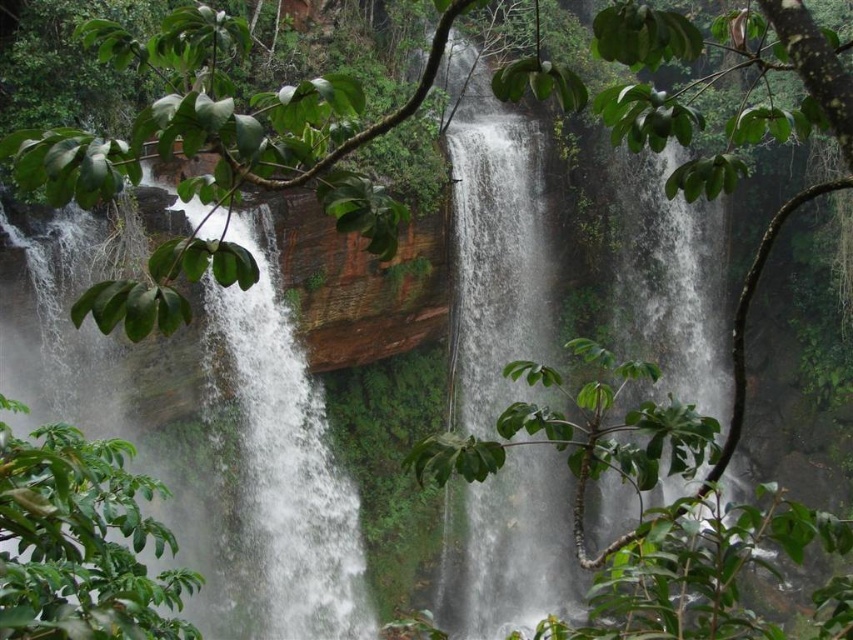
Is white frothy water at center thinner than green leafy tree at lower left?

Indeed, white frothy water at center has a lesser width compared to green leafy tree at lower left.

Does point (495, 632) lie behind point (0, 428)?

Yes, it is.

Which is in front, point (541, 536) or point (158, 625)?

Point (158, 625) is in front.

Find the location of a particular element. The width and height of the screenshot is (853, 640). white frothy water at center is located at coordinates (494, 248).